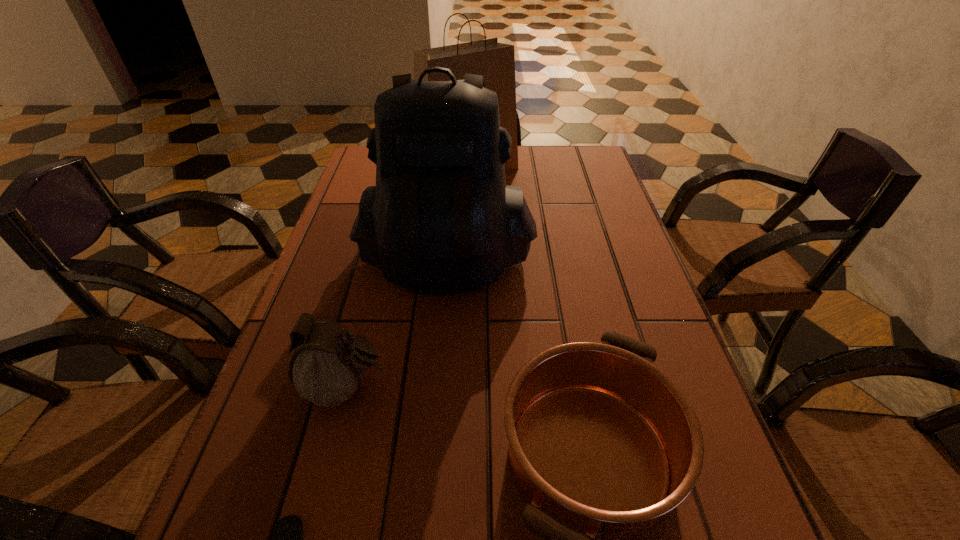
The height and width of the screenshot is (540, 960). I want to click on vacant space at the right edge of the desktop, so click(614, 295).

In the image, there is a desktop. Identify the location of vacant space at the far right corner. The height and width of the screenshot is (540, 960). (586, 174).

Choose which object is the third nearest neighbor to the backpack. Please provide its 2D coordinates. Your answer should be formatted as a tuple, i.e. [(x, y)], where the tuple contains the x and y coordinates of a point satisfying the conditions above.

[(602, 443)]

I want to click on object that ranks as the closest to the fourth nearest object, so click(327, 367).

In order to click on free space that satisfies the following two spatial constraints: 1. at the front pocket of the fourth nearest object; 2. on the front-facing side of the pouch in this screenshot , I will do `click(434, 388)`.